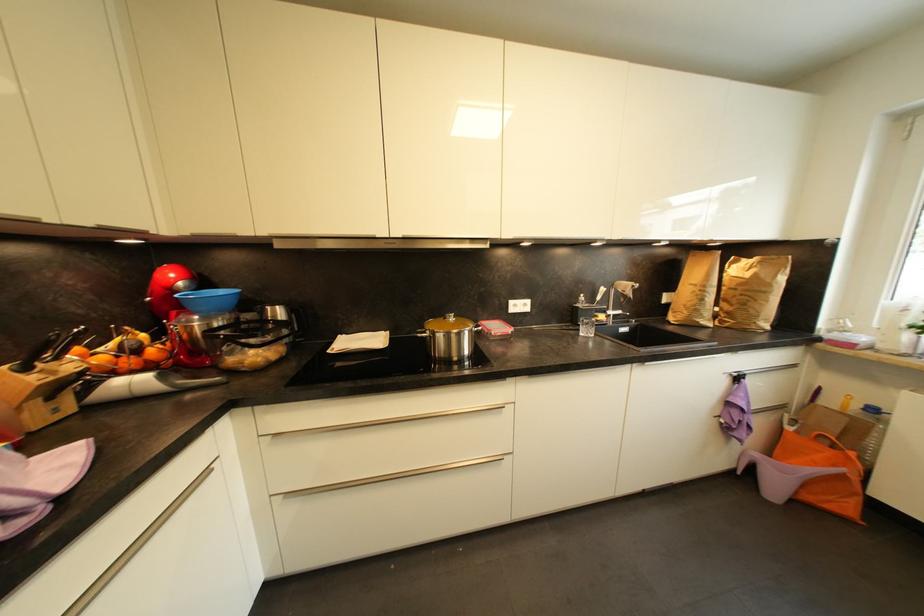
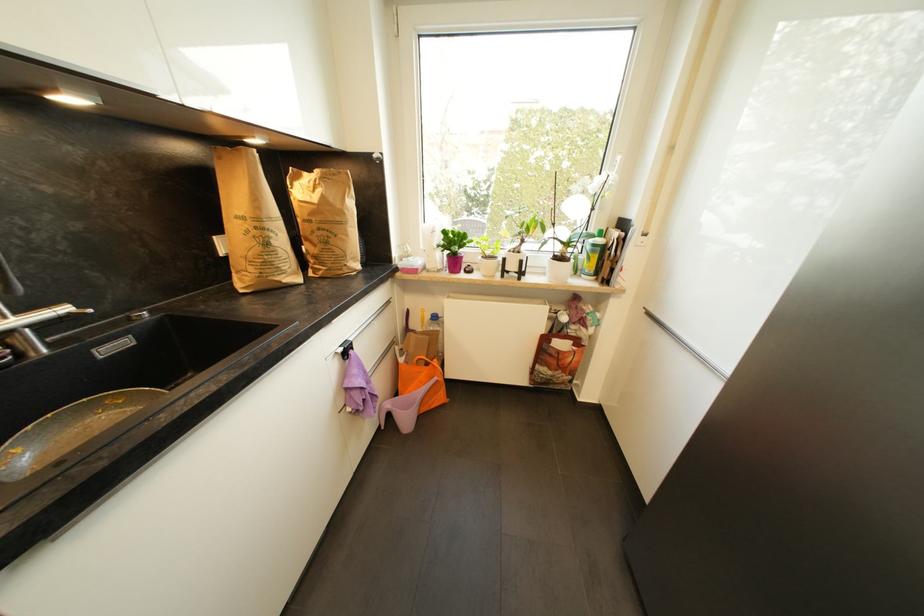
The point at (853, 509) is marked in the first image. Where is the corresponding point in the second image?

(445, 399)